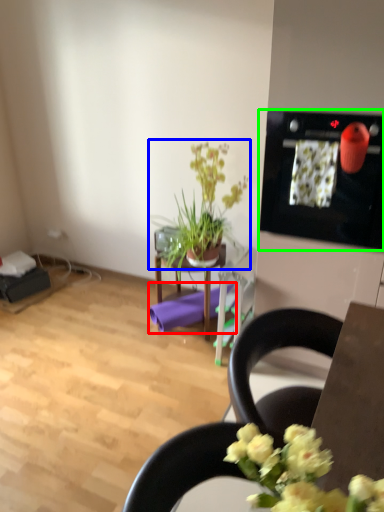
Question: Which object is positioned farthest from yoga mat (highlighted by a red box)? Select from houseplant (highlighted by a blue box) and appliance (highlighted by a green box).

Choices:
 (A) houseplant
 (B) appliance

Answer: (B)